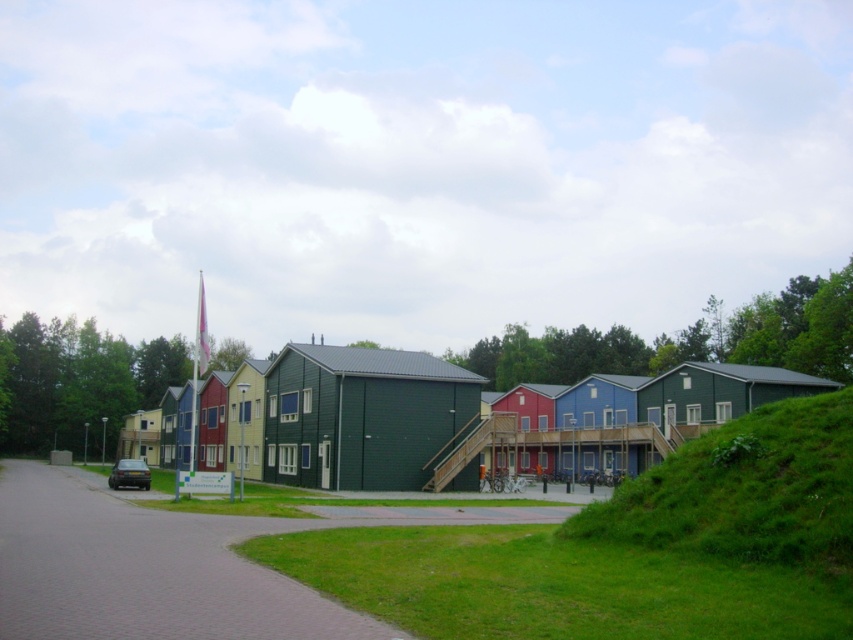
You are standing on the paved path and want to take a photo of both the green grassy hillside at lower right and the green wooden house at center. Which object should you focus on first to ensure both are in clear view?

The green grassy hillside at lower right is closer to the viewer than the green wooden house at center, so you should focus on the green grassy hillside at lower right first to ensure both are in clear view.

You are standing in front of the row of colorful houses and want to walk to the car parked on the left side. There are two points marked on the path. Which point is closer to you, point [815,433] or point [318,358]?

Point [815,433] is closer to the viewer than point [318,358], so the closer point to you is point [815,433].

You are standing at the green wooden house at center and want to walk to the green grassy hillside at lower right. The path you need to take is 23.74 meters long. If your walking speed is 1.5 meters per second, how many seconds will it take you to reach the hillside?

The distance between the green grassy hillside at lower right and the green wooden house at center is 23.74 meters. At a walking speed of 1.5 meters per second, it will take approximately 15.83 seconds to reach the hillside.